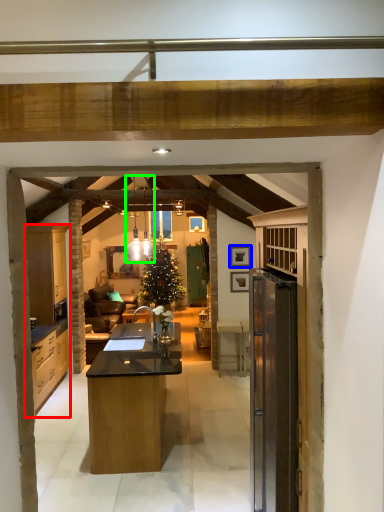
Question: Which is farther away from cabinetry (highlighted by a red box)? picture frame (highlighted by a blue box) or lamp (highlighted by a green box)?

Choices:
 (A) picture frame
 (B) lamp

Answer: (A)